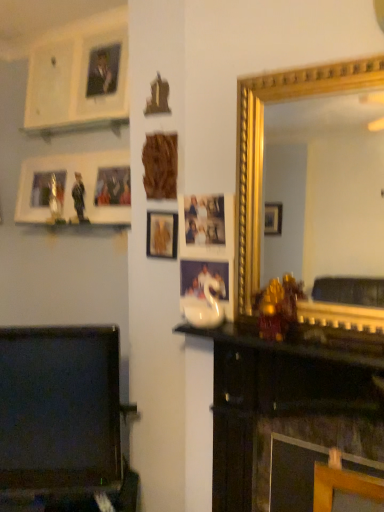
The width and height of the screenshot is (384, 512). I want to click on vacant point above black glossy mantle at center (from a real-world perspective), so click(280, 337).